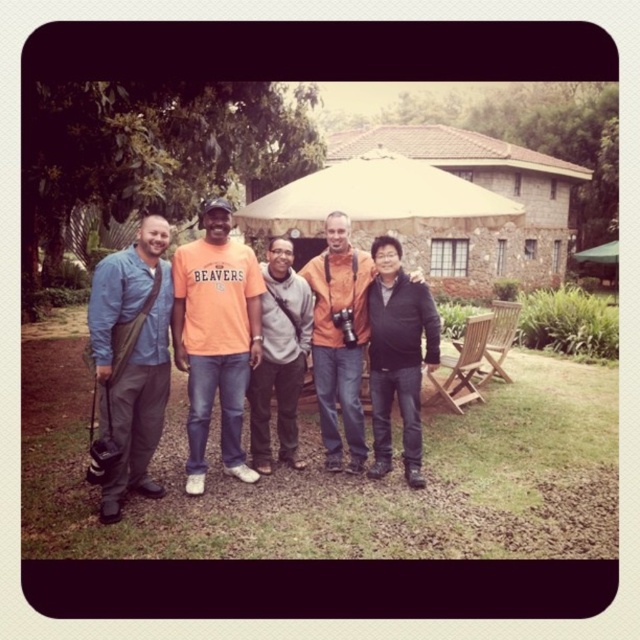
Can you confirm if orange matte jacket at center is taller than black matte jacket at center?

Yes, orange matte jacket at center is taller than black matte jacket at center.

Is orange matte jacket at center closer to the viewer compared to black matte jacket at center?

No, it is behind black matte jacket at center.

Image resolution: width=640 pixels, height=640 pixels. What are the coordinates of `orange matte jacket at center` in the screenshot? It's located at (339, 339).

Based on the photo, who is taller, matte blue shirt at left or orange cotton t-shirt at center?

Standing taller between the two is orange cotton t-shirt at center.

Based on the photo, does matte blue shirt at left appear over orange cotton t-shirt at center?

No.

Who is more distant from viewer, (88, 467) or (234, 282)?

The point (88, 467) is more distant.

Where is `matte blue shirt at left`? The image size is (640, 640). matte blue shirt at left is located at coordinates (131, 358).

Between orange matte jacket at center and orange cotton shirt at center, which one is positioned lower?

orange cotton shirt at center is below.

Does orange matte jacket at center have a larger size compared to orange cotton shirt at center?

Yes.

Between point (356, 346) and point (292, 465), which one is positioned behind?

The point (356, 346) is behind.

Find the location of a particular element. The image size is (640, 640). orange matte jacket at center is located at coordinates (339, 339).